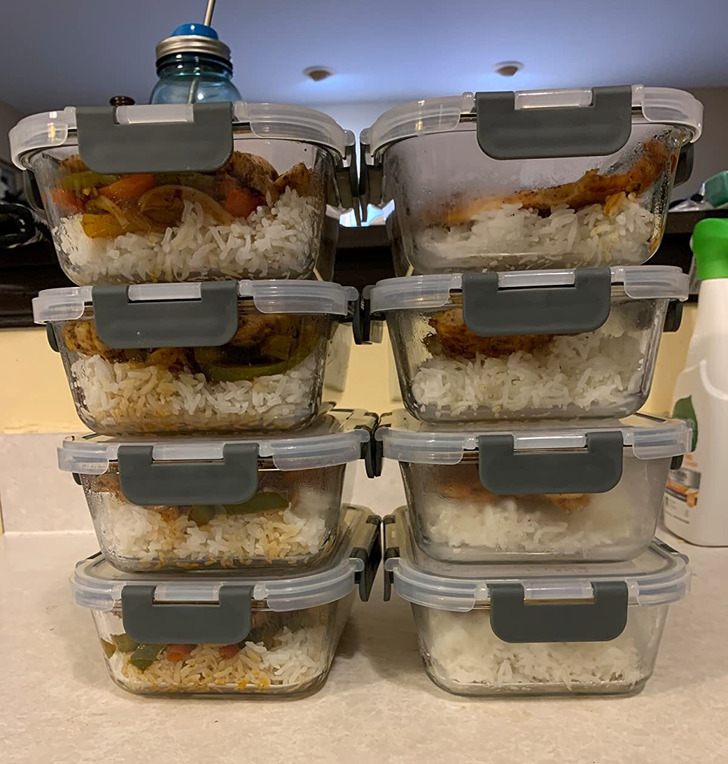
Locate an element on the screen. This screenshot has width=728, height=764. white plastic spray bottle is located at coordinates (712, 348).